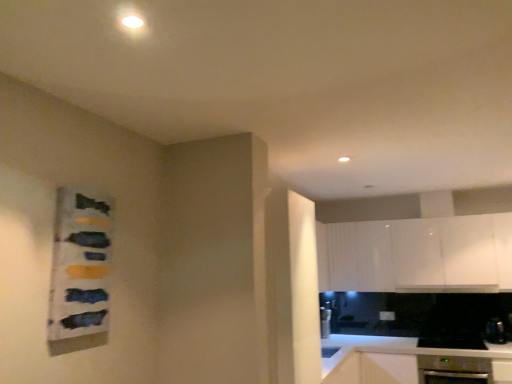
This screenshot has height=384, width=512. Identify the location of blank space situated above satin black oven at lower right, the 1th appliance in the right-to-left sequence (from a real-world perspective). (499, 317).